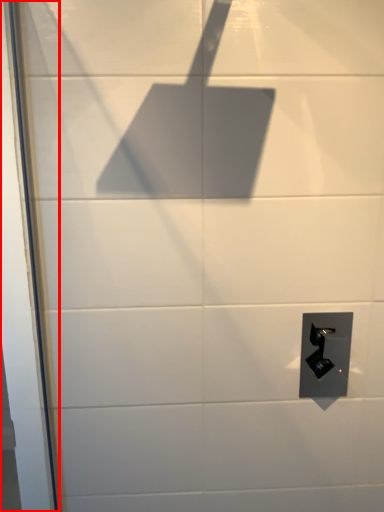
Question: From the image's perspective, where is screen door (annotated by the red box) located relative to door handle?

Choices:
 (A) below
 (B) above

Answer: (B)